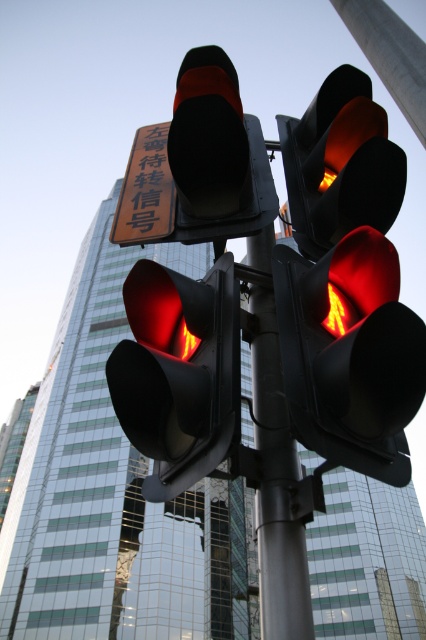
Between metallic pole at center and orange reflective sign at upper center, which one is positioned lower?

Positioned lower is metallic pole at center.

Where is `metallic pole at center`? The height and width of the screenshot is (640, 426). metallic pole at center is located at coordinates (276, 486).

Between point (212, 316) and point (265, 401), which one is positioned in front?

Point (212, 316)

Which is behind, point (238, 285) or point (308, 621)?

The point (238, 285) is behind.

I want to click on matte black traffic light at left, so click(178, 372).

Is matte black traffic light at center above matte black traffic light at left?

Actually, matte black traffic light at center is below matte black traffic light at left.

Does matte black traffic light at center have a larger size compared to matte black traffic light at left?

Indeed, matte black traffic light at center has a larger size compared to matte black traffic light at left.

Is point (394, 460) less distant than point (134, 413)?

Yes, it is.

Locate an element on the screen. The height and width of the screenshot is (640, 426). matte black traffic light at center is located at coordinates (351, 353).